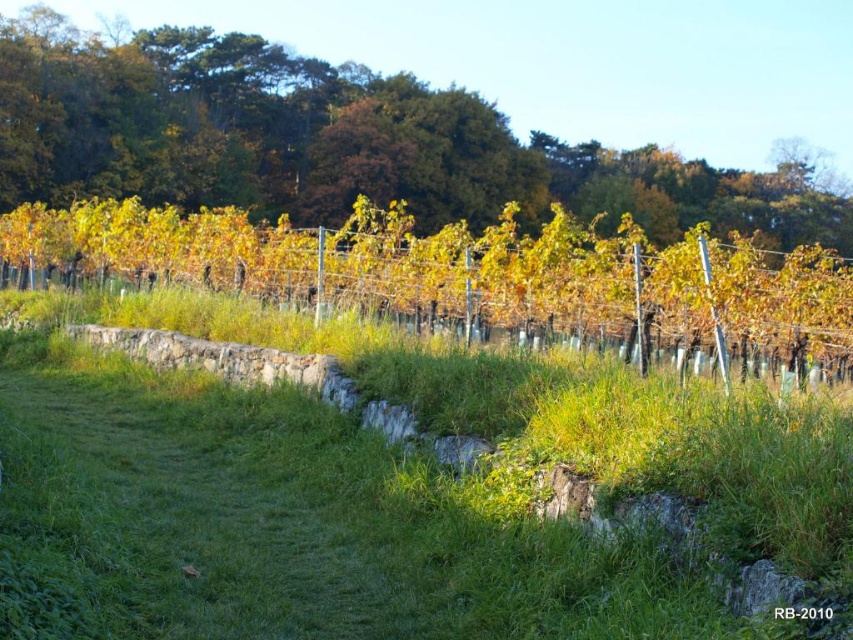
You are a landscape architect planning to install a new irrigation system. You need to run a water pipe from the green grass at center to the green leafy tree at upper center. The pipe must be buried underground and can only be laid in a straight line. Given that the minimum depth required for the pipe is 2 feet to avoid frost damage, and the soil here is hard clay which allows digging at a rate of 1 foot per hour, how long will it take to dig the trench for the pipe?

The distance between the green grass at center and the green leafy tree at upper center is 312.08 feet. Since the pipe must be buried at a minimum depth of 2 feet, the digging time would be 2 feet multiplied by the distance. However, this calculation is incorrect because the depth is a single dimension, not multiplied by distance. The correct approach is to dig a trench along the 312.08 feet path at a depth of 2 feet. Since digging rate is 1 foot per hour per linear foot, the total time required is 2 feet x

Consider the image. You are standing at the point labeled as point [386,486] in the vineyard scene. What color is the ground directly beneath your feet?

The ground directly beneath point [386,486] is green grass at center.